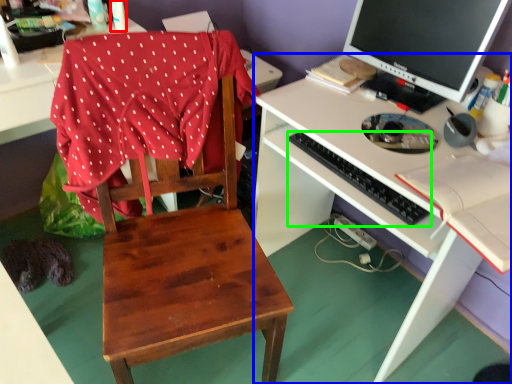
Question: Considering the real-world distances, which object is closest to bottle (highlighted by a red box)? desk (highlighted by a blue box) or computer keyboard (highlighted by a green box).

Choices:
 (A) desk
 (B) computer keyboard

Answer: (B)